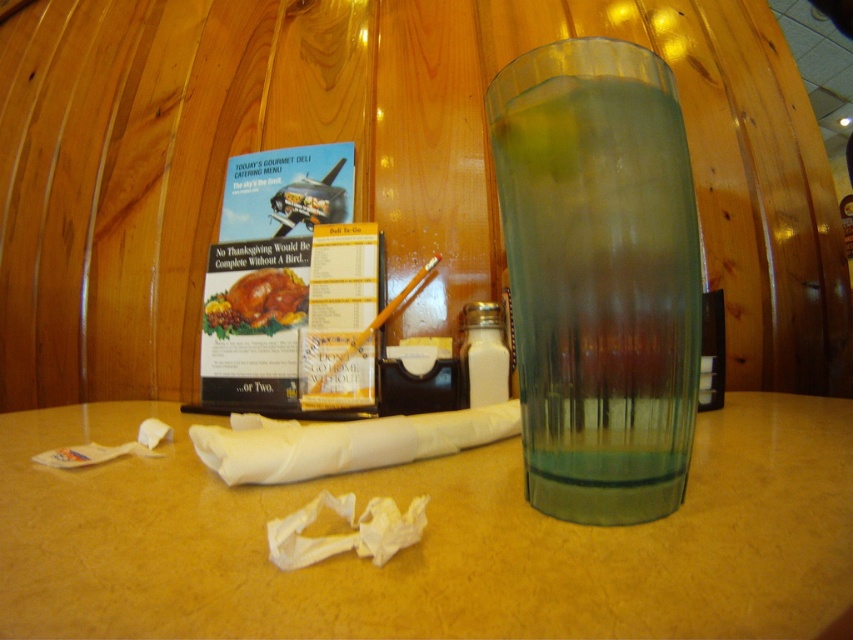
You are a customer at the diner and want to place your phone on the smooth beige table at center. However, you notice the clear glass at right nearby. Will the table surface be tall enough to avoid the glass blocking your view of the phone?

The smooth beige table at center is shorter than the clear glass at right, so placing the phone there may cause the glass to block your view since the table is lower.

From the picture: You are a waiter who needs to place a new menu stand on the table. The menu stand must be placed to the right of the smooth beige table at center and to the left of the clear glass at right. Is there enough space between them for the menu stand?

The smooth beige table at center is positioned on the left side of clear glass at right, so there is space between them for the menu stand.

You are a customer sitting at the smooth beige table at center and want to reach for the clear glass at right. Is the glass within your immediate reach without moving your body?

The smooth beige table at center is in front of the clear glass at right, meaning the glass is behind the table from your perspective. Since you are sitting at the table, the glass would be positioned behind you, making it out of immediate reach without moving your body.